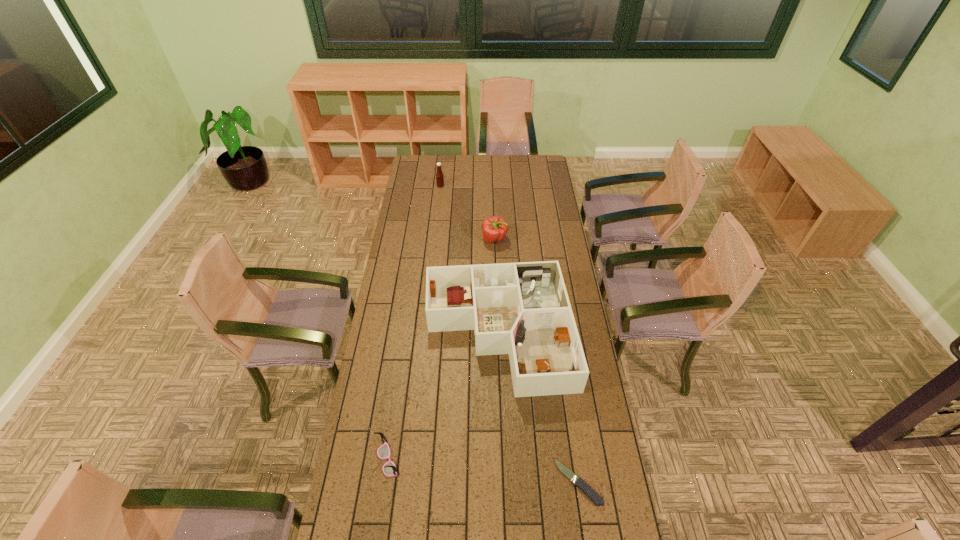
Locate an element on the screen. This screenshot has height=540, width=960. free point that satisfies the following two spatial constraints: 1. on the front side of the second farthest object; 2. on the left side of the shortest object is located at coordinates (503, 482).

The height and width of the screenshot is (540, 960). I want to click on vacant position in the image that satisfies the following two spatial constraints: 1. on the back side of the second shortest object; 2. on the right side of the Tabasco sauce, so click(427, 186).